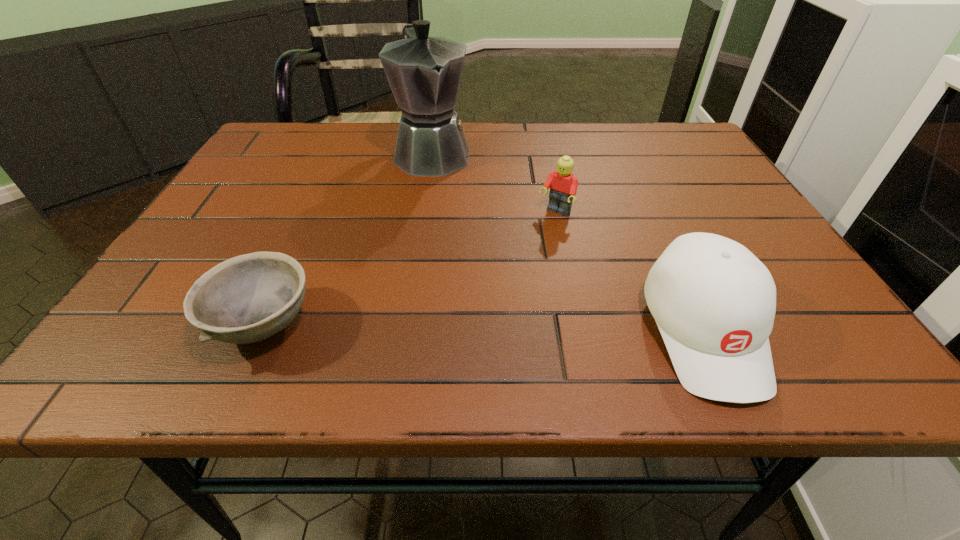
This screenshot has width=960, height=540. What are the coordinates of `bowl` in the screenshot? It's located at (248, 298).

This screenshot has width=960, height=540. I want to click on the leftmost object, so click(248, 298).

At what (x,y) coordinates should I click in order to perform the action: click on baseball cap. Please return your answer as a coordinate pair (x, y). This screenshot has height=540, width=960. Looking at the image, I should click on (714, 302).

You are a GUI agent. You are given a task and a screenshot of the screen. Output one action in this format:
    pyautogui.click(x=<x>, y=<y>)
    Task: Click on the Lego
    This screenshot has height=540, width=960.
    Given the screenshot: What is the action you would take?
    pyautogui.click(x=563, y=185)

This screenshot has height=540, width=960. In order to click on the third object from left to right in this screenshot , I will do `click(563, 185)`.

You are a GUI agent. You are given a task and a screenshot of the screen. Output one action in this format:
    pyautogui.click(x=<x>, y=<y>)
    Task: Click on the farthest object
    This screenshot has width=960, height=540.
    Given the screenshot: What is the action you would take?
    pyautogui.click(x=424, y=73)

The height and width of the screenshot is (540, 960). Find the location of `coffeepot`. coffeepot is located at coordinates (424, 73).

Where is `free space located on the right of the leftmost object`? free space located on the right of the leftmost object is located at coordinates coord(400,324).

What are the coordinates of `vacant space located on the face of the second farthest object` in the screenshot? It's located at (468, 318).

This screenshot has height=540, width=960. I want to click on free space located on the face of the second farthest object, so click(480, 303).